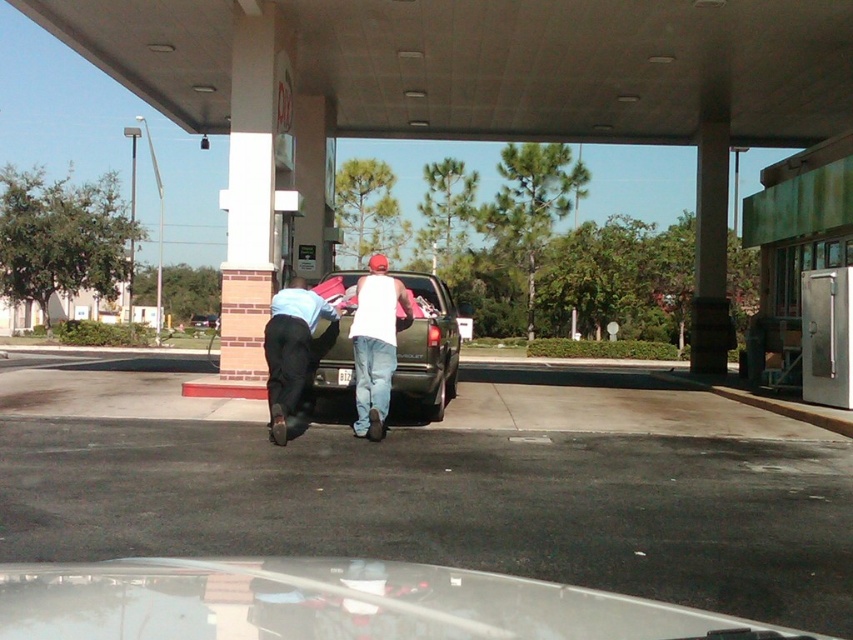
Which is in front, point (335, 388) or point (279, 323)?

Point (279, 323)

Who is higher up, metallic green truck at center or light blue jeans at lower left?

Positioned higher is light blue jeans at lower left.

This screenshot has width=853, height=640. Describe the element at coordinates (427, 348) in the screenshot. I see `metallic green truck at center` at that location.

You are a GUI agent. You are given a task and a screenshot of the screen. Output one action in this format:
    pyautogui.click(x=<x>, y=<y>)
    Task: Click on the metallic green truck at center
    The width and height of the screenshot is (853, 640).
    Given the screenshot: What is the action you would take?
    pyautogui.click(x=427, y=348)

From the picture: Does white matte tank top at center have a greater height compared to light blue jeans at lower left?

Correct, white matte tank top at center is much taller as light blue jeans at lower left.

From the picture: Is white matte tank top at center below light blue jeans at lower left?

No.

The width and height of the screenshot is (853, 640). I want to click on white matte tank top at center, so click(x=375, y=344).

Locate an element on the screen. white matte tank top at center is located at coordinates (375, 344).

Looking at this image, is metallic green pickup truck at center bigger than light blue jeans at lower left?

Correct, metallic green pickup truck at center is larger in size than light blue jeans at lower left.

Which of these two, metallic green pickup truck at center or light blue jeans at lower left, stands taller?

Standing taller between the two is light blue jeans at lower left.

Measure the distance between metallic green pickup truck at center and camera.

They are 8.97 feet apart.

Image resolution: width=853 pixels, height=640 pixels. What are the coordinates of `metallic green pickup truck at center` in the screenshot? It's located at (332, 604).